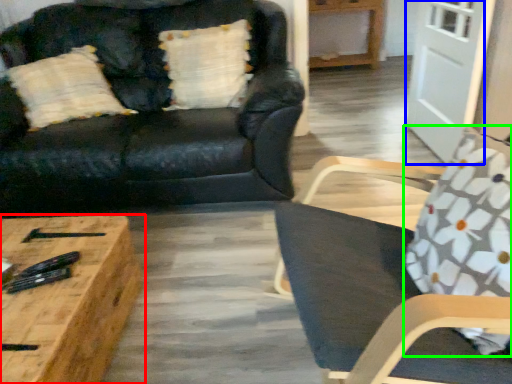
Question: Estimate the real-world distances between objects in this image. Which object is closer to coffee table (highlighted by a red box), glass door (highlighted by a blue box) or throw pillow (highlighted by a green box)?

Choices:
 (A) glass door
 (B) throw pillow

Answer: (B)